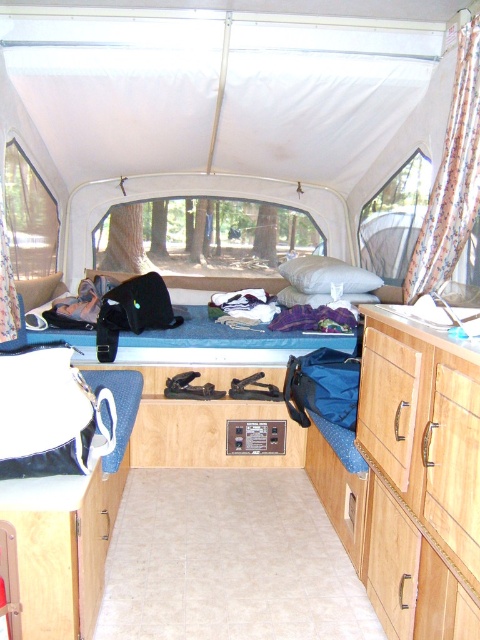
Question: Estimate the real-world distances between objects in this image. Which object is closer to the wooden drawer at center-right?

Choices:
 (A) floral fabric curtain at left
 (B) floral fabric curtain at right
 (C) blue fabric bed at center

Answer: (B)

Question: Among these objects, which one is nearest to the camera?

Choices:
 (A) floral fabric curtain at right
 (B) floral fabric curtain at left
 (C) wooden drawer at center-right

Answer: (C)

Question: Does wooden drawer at center-right have a smaller size compared to floral fabric curtain at left?

Choices:
 (A) yes
 (B) no

Answer: (B)

Question: Where is wooden drawer at center-right located in relation to blue fabric bed at center in the image?

Choices:
 (A) below
 (B) above

Answer: (A)

Question: Does wooden drawer at center-right appear on the right side of floral fabric curtain at left?

Choices:
 (A) yes
 (B) no

Answer: (A)

Question: Estimate the real-world distances between objects in this image. Which object is closer to the blue fabric bed at center?

Choices:
 (A) floral fabric curtain at left
 (B) floral fabric curtain at right
 (C) wooden drawer at center-right

Answer: (A)